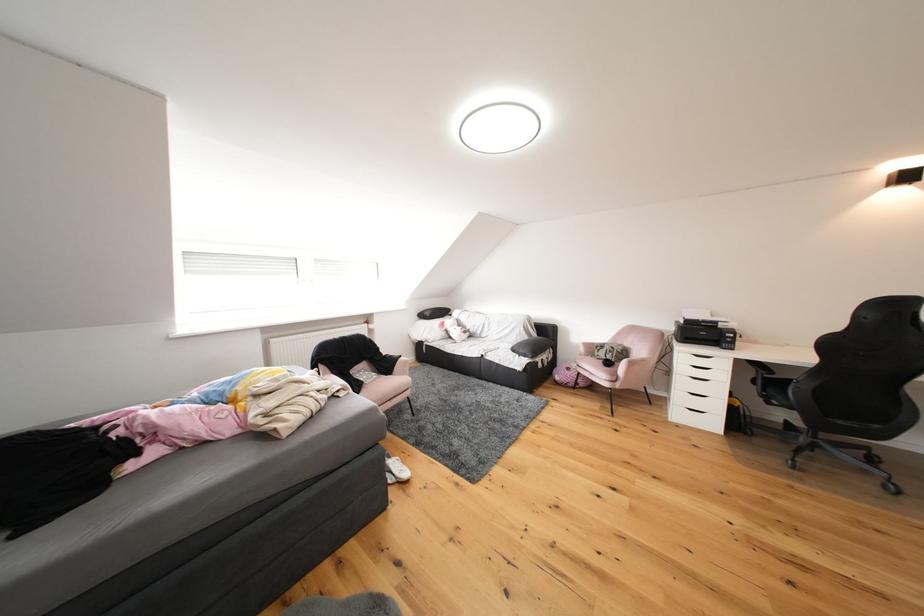
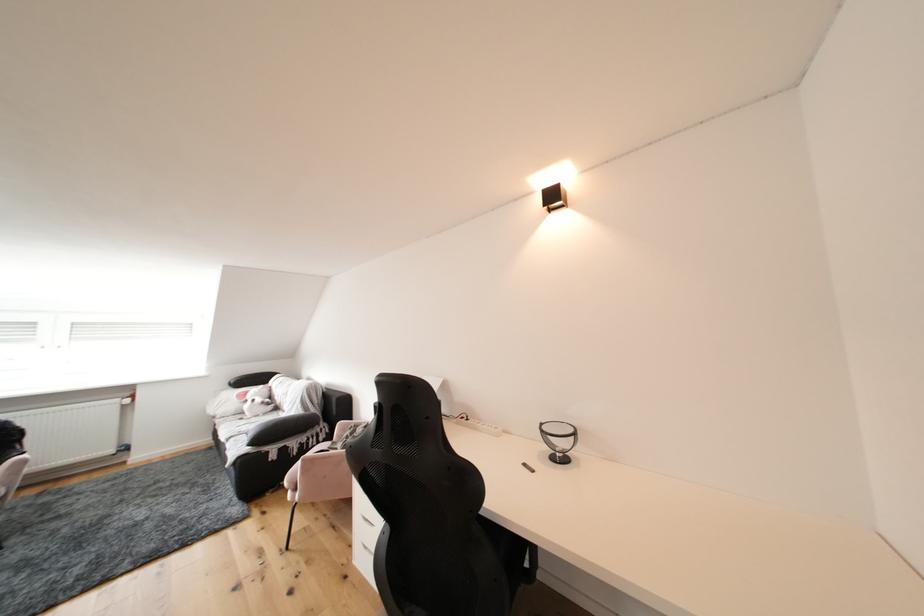
Where in the second image is the point corresponding to pixel 453 328 from the first image?

(256, 397)